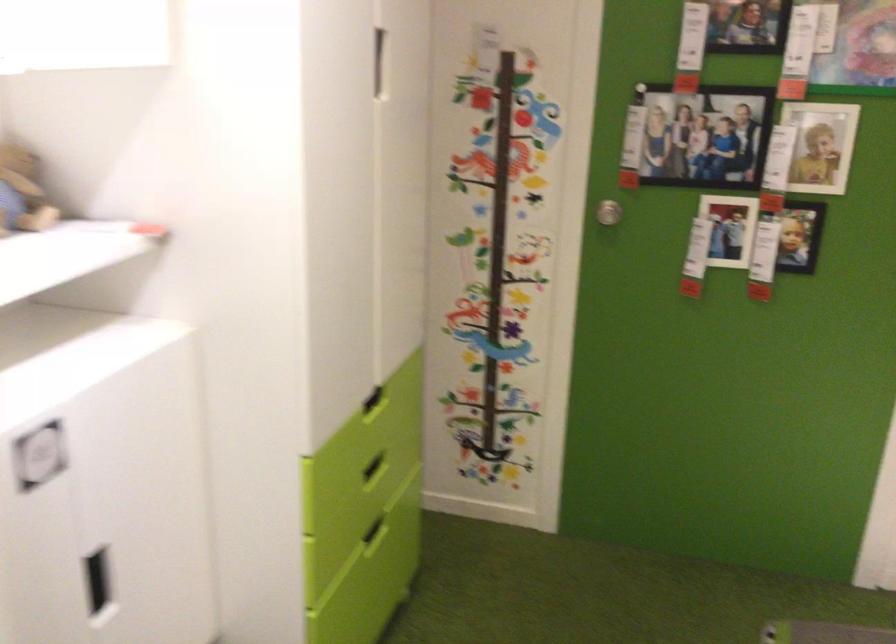
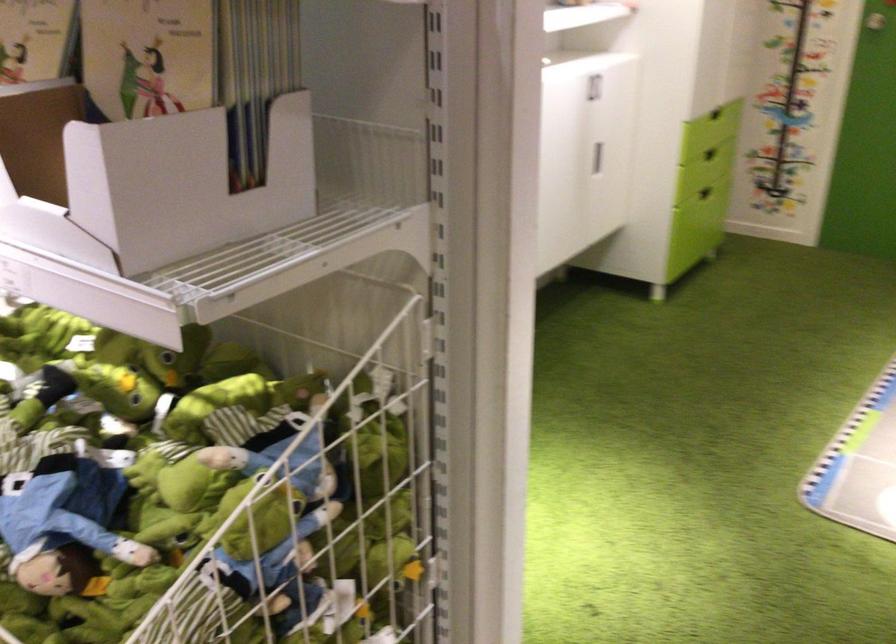
Locate, in the second image, the point that corresponds to [358,471] in the first image.

(710, 154)